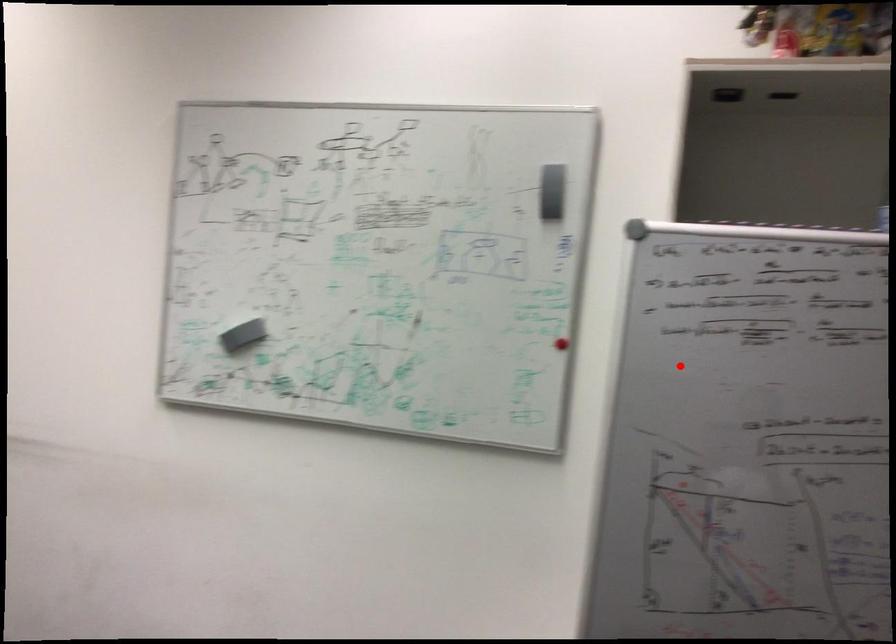
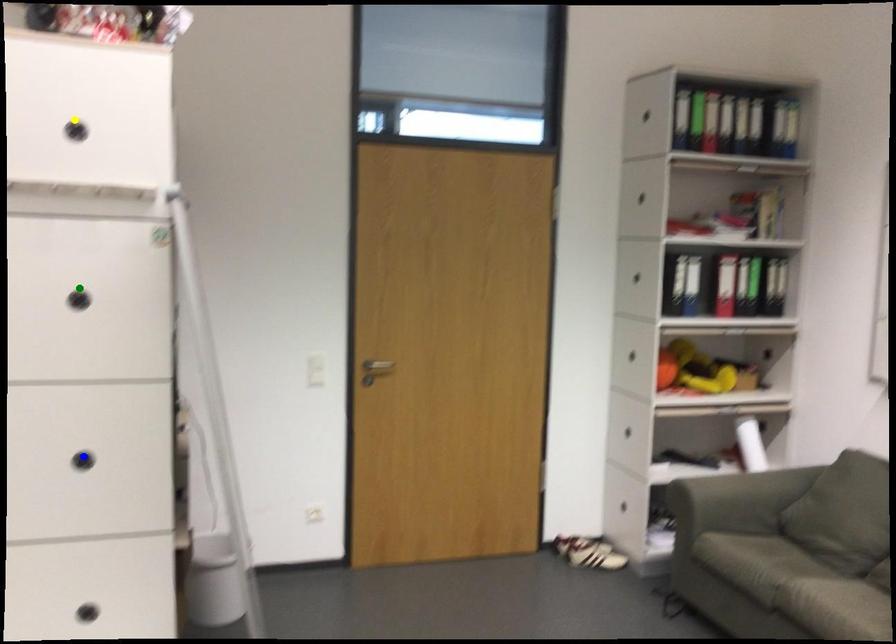
Question: I am providing you with two images of the same scene from different viewpoints. A red point is marked on the first image. You are given multiple points on the second image. Which mark in image 2 goes with the point in image 1?

Choices:
 (A) yellow point
 (B) green point
 (C) blue point

Answer: (B)